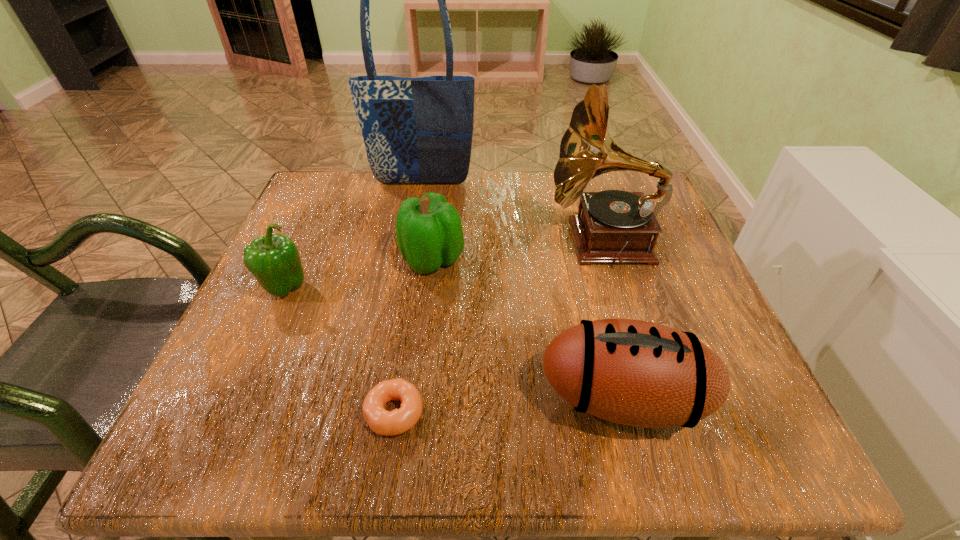
This screenshot has width=960, height=540. Identify the location of vacant space located 0.150m on the horn of the phonograph_record. (477, 241).

Identify the location of free space located 0.260m on the left of the right bell pepper. The width and height of the screenshot is (960, 540). (270, 259).

I want to click on vacant space located on the right of the leftmost object, so coord(436,288).

This screenshot has height=540, width=960. Identify the location of vacant space located 0.130m on the left of the football (American). (453, 398).

At what (x,y) coordinates should I click in order to perform the action: click on free space located on the back of the shortest object. Please return your answer as a coordinate pair (x, y). This screenshot has width=960, height=540. Looking at the image, I should click on (419, 251).

Where is `shopping bag that is at the far edge`? The width and height of the screenshot is (960, 540). shopping bag that is at the far edge is located at coordinates (419, 130).

Locate an element on the screen. The width and height of the screenshot is (960, 540). phonograph_record located in the far edge section of the desktop is located at coordinates (616, 226).

The width and height of the screenshot is (960, 540). I want to click on football (American) present at the near edge, so click(x=637, y=373).

The width and height of the screenshot is (960, 540). Identify the location of doughnut positioned at the near edge. (382, 422).

The image size is (960, 540). Find the location of `shopping bag situated at the left edge`. shopping bag situated at the left edge is located at coordinates (419, 130).